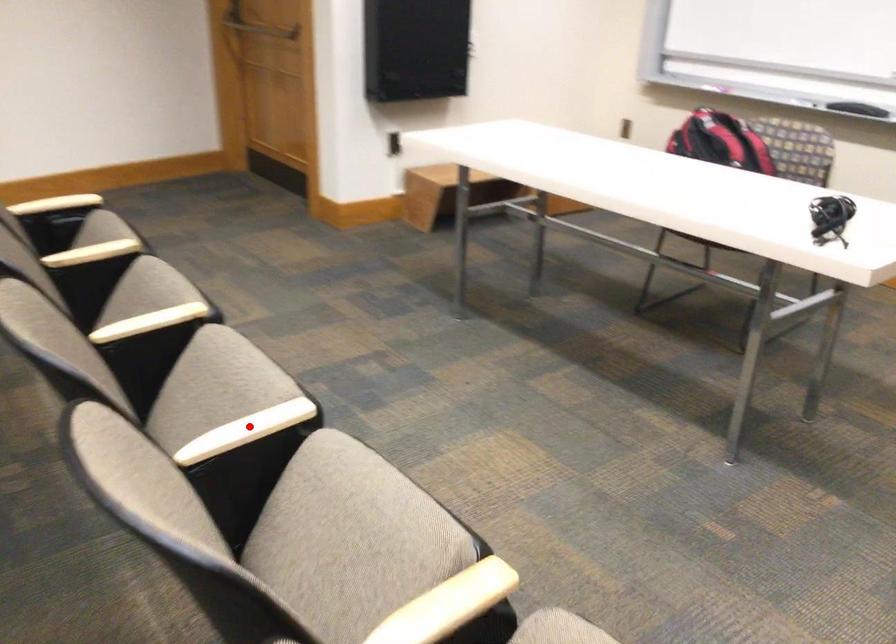
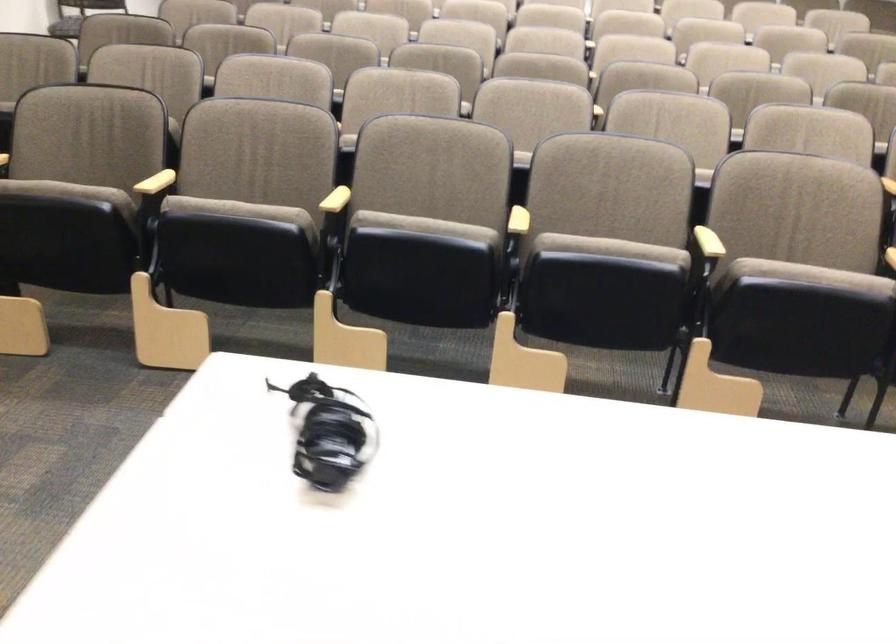
Locate, in the second image, the point that corresponds to the highlighted location in the first image.

(518, 221)